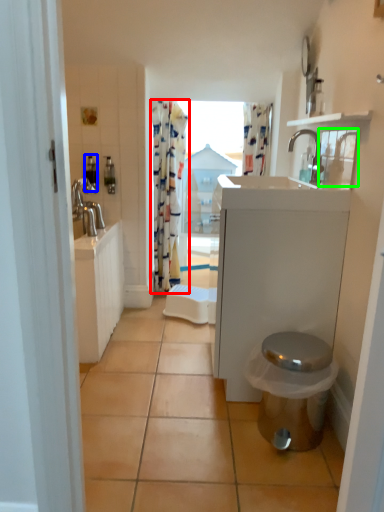
Question: Based on their relative distances, which object is farther from curtain (highlighted by a red box)? Choose from toiletry (highlighted by a blue box) and medicine cabinet (highlighted by a green box).

Choices:
 (A) toiletry
 (B) medicine cabinet

Answer: (B)